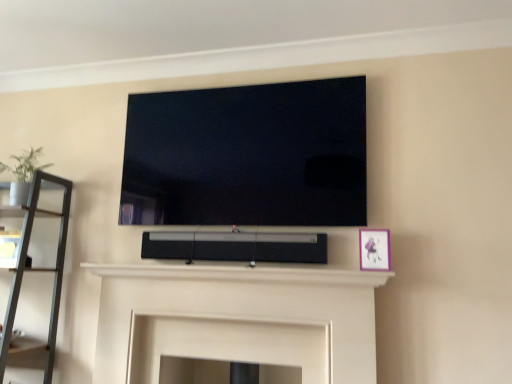
Identify the location of vacant space in between matte pink picture frame at right and black matte speaker at center. (278, 273).